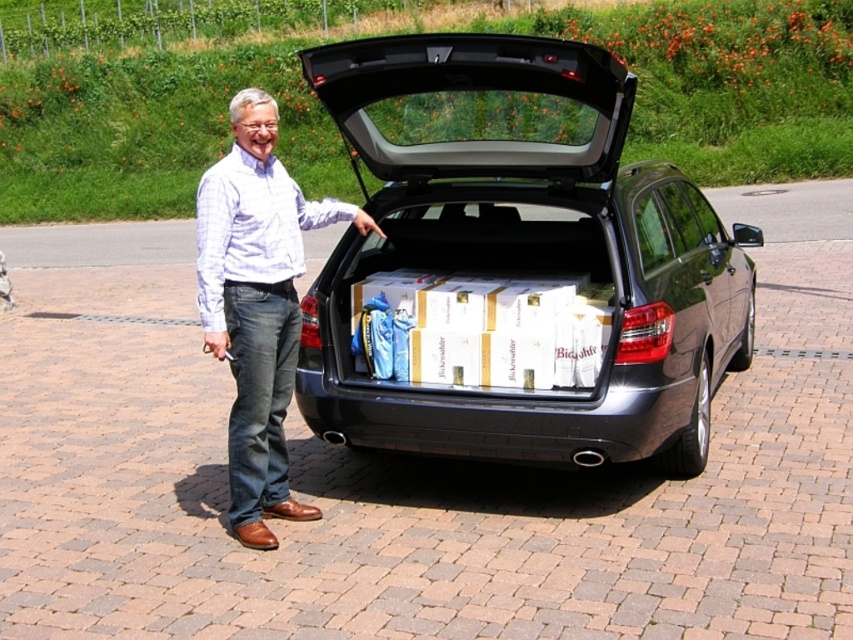
Question: Which point appears closest to the camera in this image?

Choices:
 (A) (440, 125)
 (B) (366, 225)

Answer: (B)

Question: Which point appears farthest from the camera in this image?

Choices:
 (A) (634, 196)
 (B) (271, 420)

Answer: (A)

Question: Is satin black car at center positioned before light blue plaid shirt at center?

Choices:
 (A) no
 (B) yes

Answer: (B)

Question: In this image, where is satin black car at center located relative to light blue plaid shirt at center?

Choices:
 (A) above
 (B) below

Answer: (B)

Question: Which of the following is the farthest from the observer?

Choices:
 (A) satin black car at center
 (B) light blue plaid shirt at center

Answer: (B)

Question: Is satin black car at center wider than light blue plaid shirt at center?

Choices:
 (A) yes
 (B) no

Answer: (A)